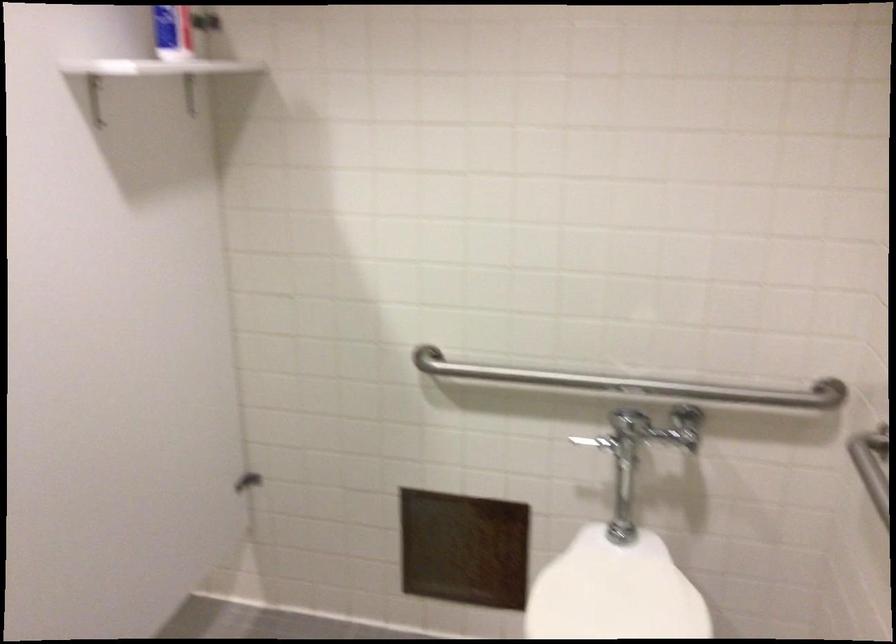
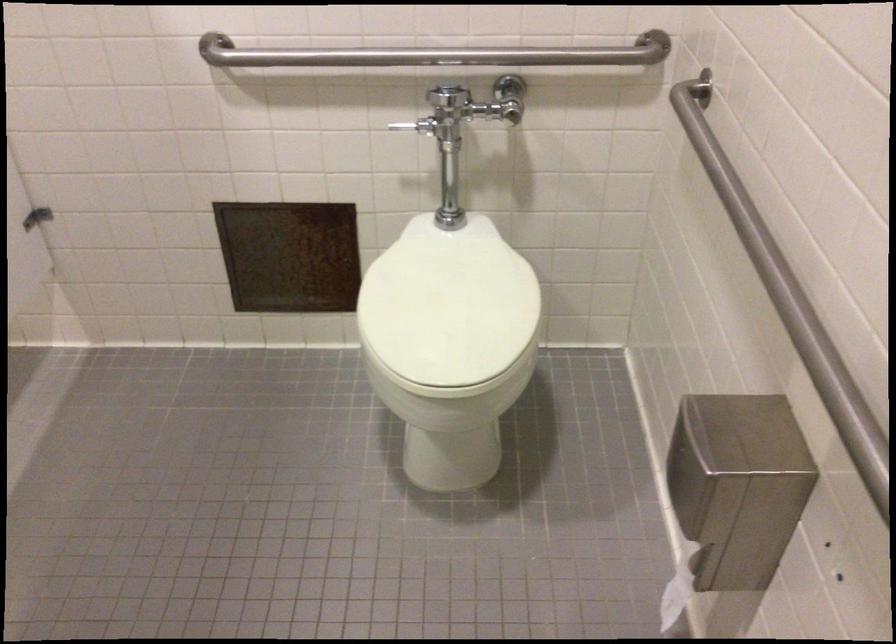
Find the pixel in the second image that matches point (618, 380) in the first image.

(436, 55)